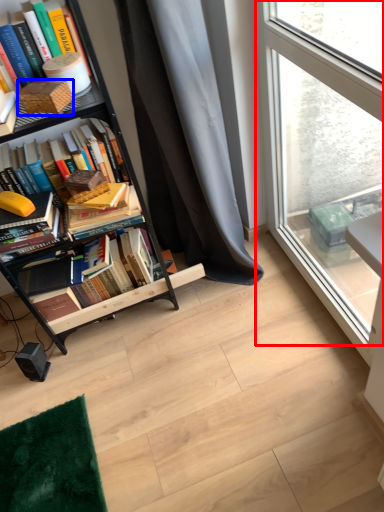
Question: Which point is further to the camera, window (highlighted by a red box) or paperback book (highlighted by a blue box)?

Choices:
 (A) window
 (B) paperback book

Answer: (B)